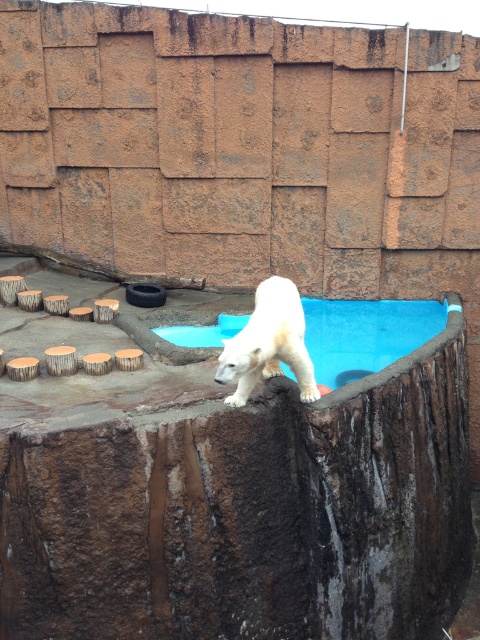
Question: Does blue smooth water at upper center appear on the left side of white fur bear at center?

Choices:
 (A) no
 (B) yes

Answer: (A)

Question: Among these objects, which one is nearest to the camera?

Choices:
 (A) blue smooth water at upper center
 (B) white fur bear at center

Answer: (B)

Question: Which point is closer to the camera taking this photo?

Choices:
 (A) (321, 340)
 (B) (300, 394)

Answer: (B)

Question: In this image, where is blue smooth water at upper center located relative to white fur bear at center?

Choices:
 (A) right
 (B) left

Answer: (A)

Question: Which point is closer to the camera taking this photo?

Choices:
 (A) (222, 314)
 (B) (259, 328)

Answer: (B)

Question: Is blue smooth water at upper center in front of white fur bear at center?

Choices:
 (A) yes
 (B) no

Answer: (B)